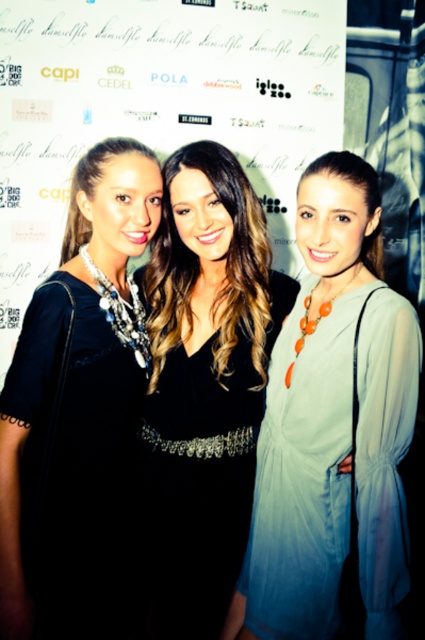
Who is positioned more to the right, white paper at center or matte black dress at left?

From the viewer's perspective, white paper at center appears more on the right side.

Between point (297, 40) and point (40, 404), which one is positioned in front?

Point (40, 404)

This screenshot has height=640, width=425. I want to click on white paper at center, so click(156, 108).

Which is in front, point (169, 228) or point (91, 419)?

Point (91, 419)

Between point (251, 250) and point (133, 330), which one is positioned behind?

The point (251, 250) is behind.

Where is `black satin dress at center`? black satin dress at center is located at coordinates pyautogui.click(x=203, y=388).

You are a GUI agent. You are given a task and a screenshot of the screen. Output one action in this format:
    pyautogui.click(x=<x>, y=<y>)
    Task: Click on the white paper at center
    Image resolution: width=425 pixels, height=640 pixels.
    Given the screenshot: What is the action you would take?
    [x=156, y=108]

Which is below, white paper at center or matte blue dress at center?

Positioned lower is matte blue dress at center.

Where is `white paper at center`? The height and width of the screenshot is (640, 425). white paper at center is located at coordinates (156, 108).